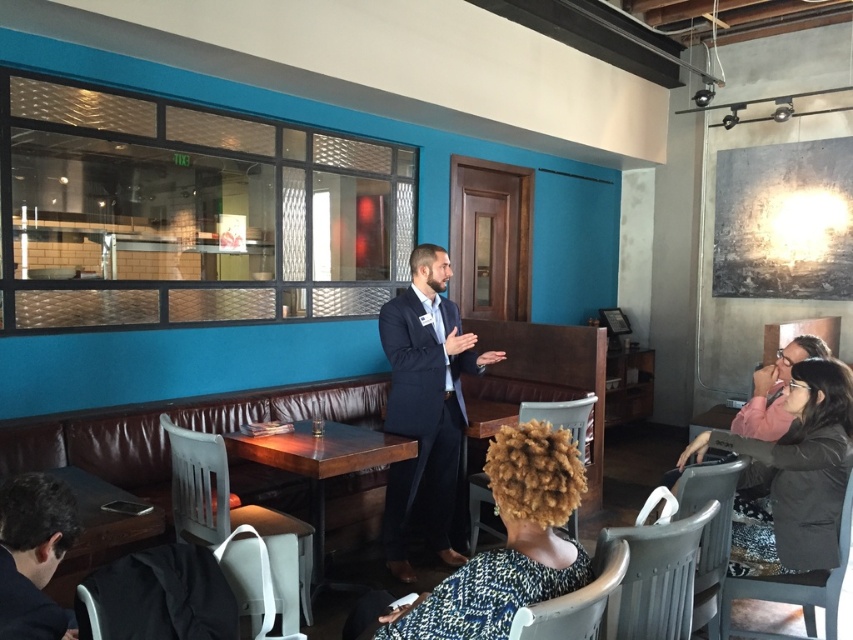
Question: Observing the image, what is the correct spatial positioning of dark blue suit at center in reference to black matte jacket at lower right?

Choices:
 (A) below
 (B) above

Answer: (B)

Question: Which point is closer to the camera?

Choices:
 (A) black matte jacket at lower right
 (B) dark brown leather jacket at lower left
 (C) dark blue suit at center

Answer: (B)

Question: Considering the relative positions of black matte jacket at lower right and dark brown leather jacket at lower left in the image provided, where is black matte jacket at lower right located with respect to dark brown leather jacket at lower left?

Choices:
 (A) below
 (B) above

Answer: (B)

Question: Does dark blue suit at center have a smaller size compared to dark brown leather jacket at lower left?

Choices:
 (A) no
 (B) yes

Answer: (A)

Question: Among these points, which one is nearest to the camera?

Choices:
 (A) (440, 582)
 (B) (772, 528)
 (C) (36, 499)
 (D) (308, 420)

Answer: (A)

Question: Which of the following is the farthest from the observer?

Choices:
 (A) (399, 573)
 (B) (840, 493)
 (C) (48, 563)
 (D) (556, 509)

Answer: (A)